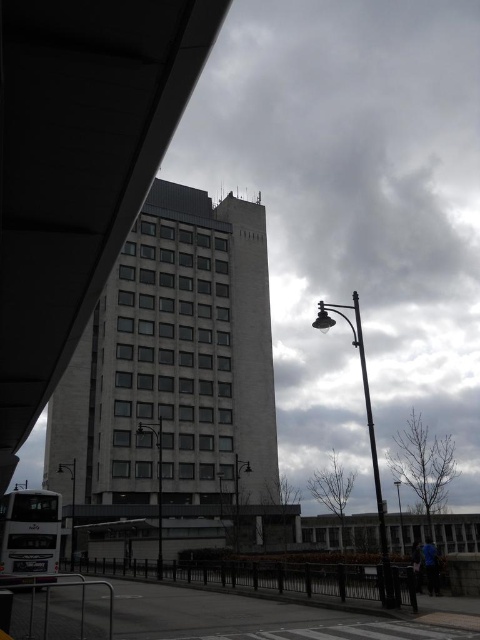
You are a pedestrian standing on the walkway near the metallic streetlight at center and the metallic gray pole at center. Which object is nearer to you?

The metallic streetlight at center is closer to the viewer than the metallic gray pole at center, so the metallic streetlight at center is nearer to you.